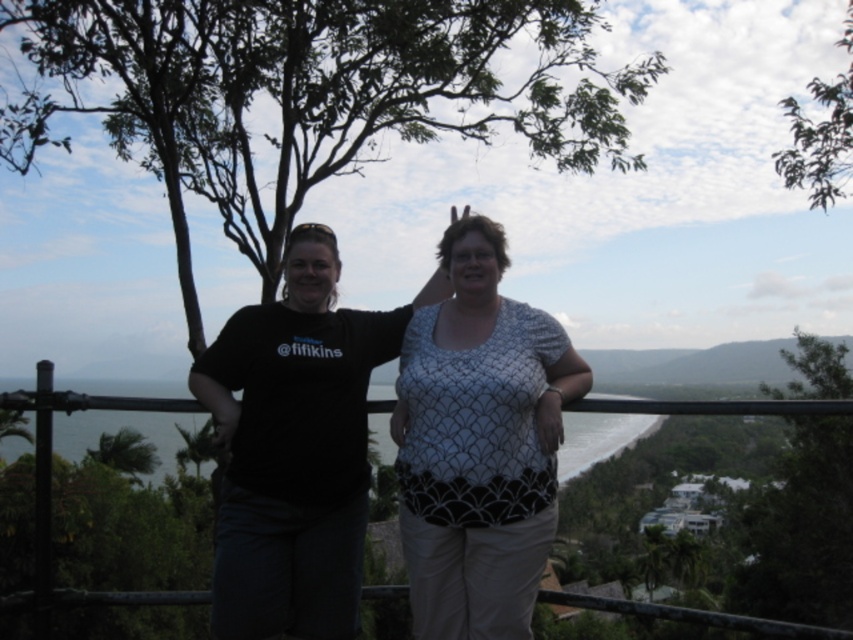
Question: Considering the real-world distances, which object is closest to the green leafy tree at upper left?

Choices:
 (A) white textured blouse at center
 (B) green leafy tree at right
 (C) black matte t-shirt at center
 (D) green leafy tree at upper right

Answer: (D)

Question: Which of the following is the farthest from the observer?

Choices:
 (A) green leafy tree at upper right
 (B) green leafy tree at right

Answer: (A)

Question: Does black matte t-shirt at center lie in front of green leafy tree at right?

Choices:
 (A) no
 (B) yes

Answer: (A)

Question: Which object appears closest to the camera in this image?

Choices:
 (A) white textured blouse at center
 (B) black matte t-shirt at center

Answer: (A)

Question: Can you confirm if black matte t-shirt at center is smaller than white textured blouse at center?

Choices:
 (A) no
 (B) yes

Answer: (A)

Question: Can you confirm if green leafy tree at right is positioned above green leafy tree at upper right?

Choices:
 (A) no
 (B) yes

Answer: (A)